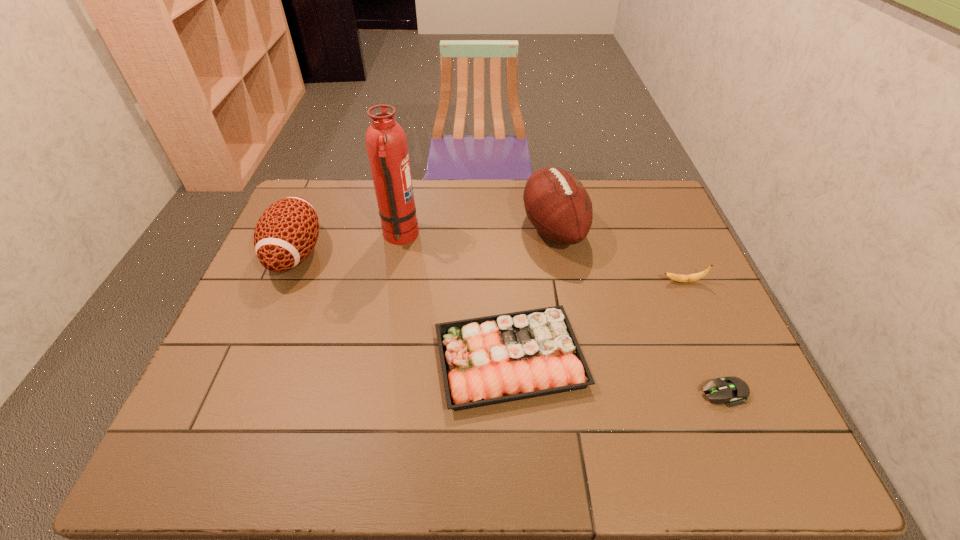
I want to click on free space located 0.130m on the left of the right football, so click(x=482, y=229).

Locate an element on the screen. vacant space located 0.230m on the right of the shorter football is located at coordinates (399, 253).

Identify the location of vacant space located on the peel of the third shortest object from the top. (539, 281).

Locate an element on the screen. Image resolution: width=960 pixels, height=540 pixels. free space located on the peel of the third shortest object from the top is located at coordinates (588, 281).

At what (x,y) coordinates should I click in order to perform the action: click on vacant position located 0.220m on the peel of the third shortest object from the top. Please return your answer as a coordinate pair (x, y). Looking at the image, I should click on (585, 281).

In order to click on free space located on the back of the second shortest object in this screenshot , I will do `click(504, 243)`.

Locate an element on the screen. This screenshot has height=540, width=960. vacant region located 0.060m on the back of the computer mouse is located at coordinates (708, 356).

Where is `fire extinguisher that is at the far edge`? The height and width of the screenshot is (540, 960). fire extinguisher that is at the far edge is located at coordinates (386, 142).

At what (x,y) coordinates should I click in order to perform the action: click on football (American) at the far edge. Please return your answer as a coordinate pair (x, y). Image resolution: width=960 pixels, height=540 pixels. Looking at the image, I should click on (557, 204).

At what (x,y) coordinates should I click in order to perform the action: click on object situated at the left edge. Please return your answer as a coordinate pair (x, y). This screenshot has width=960, height=540. Looking at the image, I should click on (286, 233).